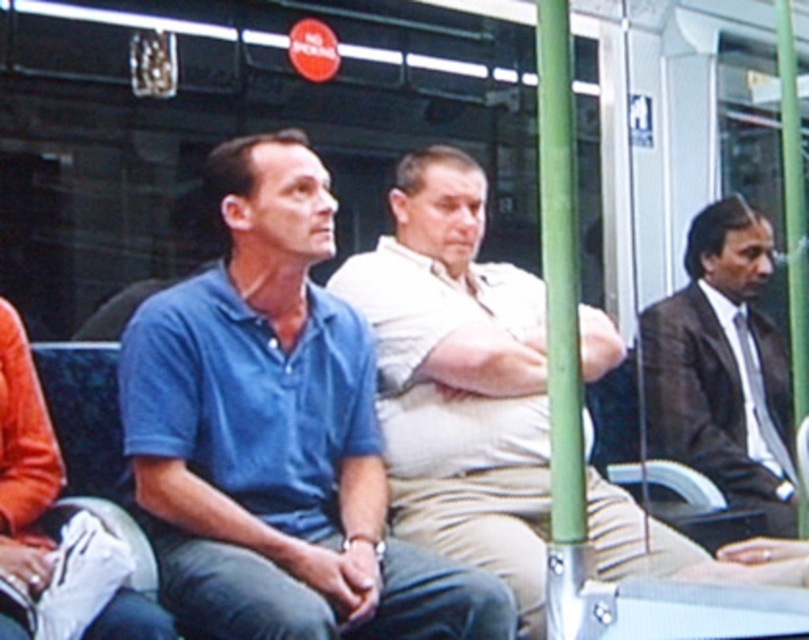
How much distance is there between blue cotton shirt at center and beige cotton shirt at center?

They are 14.41 inches apart.

Is blue cotton shirt at center taller than beige cotton shirt at center?

No.

Is point (176, 403) more distant than point (492, 348)?

No, it is in front of (492, 348).

Where is `blue cotton shirt at center`? blue cotton shirt at center is located at coordinates (276, 435).

Can you confirm if blue cotton shirt at center is taller than dark brown suit at right?

Yes.

Is point (312, 164) closer to viewer compared to point (687, 356)?

Yes, point (312, 164) is in front of point (687, 356).

Which is in front, point (253, 164) or point (790, 470)?

Point (253, 164) is more forward.

You are a GUI agent. You are given a task and a screenshot of the screen. Output one action in this format:
    pyautogui.click(x=<x>, y=<y>)
    Task: Click on the blue cotton shirt at center
    This screenshot has height=640, width=809.
    Given the screenshot: What is the action you would take?
    pyautogui.click(x=276, y=435)

Can you confirm if beige cotton shirt at center is smaller than dark brown suit at right?

Incorrect, beige cotton shirt at center is not smaller in size than dark brown suit at right.

Who is positioned more to the right, beige cotton shirt at center or dark brown suit at right?

Positioned to the right is dark brown suit at right.

Who is more distant from viewer, (411, 378) or (773, 532)?

Point (773, 532)

Image resolution: width=809 pixels, height=640 pixels. In order to click on beige cotton shirt at center in this screenshot , I will do `click(458, 378)`.